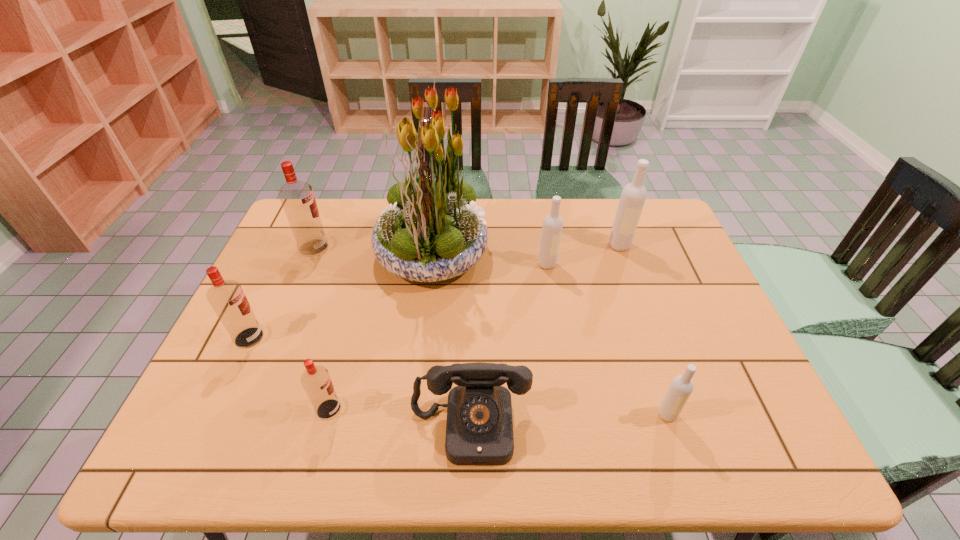
Where is `red vodka that is the second nearest to the farthest red vodka`? The image size is (960, 540). red vodka that is the second nearest to the farthest red vodka is located at coordinates (316, 381).

Locate which white vodka is the closest to the nearest white vodka. Please provide its 2D coordinates. Your answer should be formatted as a tuple, i.e. [(x, y)], where the tuple contains the x and y coordinates of a point satisfying the conditions above.

[(552, 227)]

Select which white vodka is the second closest to the biggest white vodka. Please provide its 2D coordinates. Your answer should be formatted as a tuple, i.e. [(x, y)], where the tuple contains the x and y coordinates of a point satisfying the conditions above.

[(681, 387)]

Locate an element on the screen. The image size is (960, 540). vacant position in the image that satisfies the following two spatial constraints: 1. on the front label of the smallest white vodka; 2. on the right side of the third vodka from left to right is located at coordinates (327, 414).

You are a GUI agent. You are given a task and a screenshot of the screen. Output one action in this format:
    pyautogui.click(x=<x>, y=<y>)
    Task: Click on the free space that satisfies the following two spatial constraints: 1. on the front side of the farthest white vodka; 2. on the front label of the farthest red vodka
    The height and width of the screenshot is (540, 960).
    Given the screenshot: What is the action you would take?
    pyautogui.click(x=620, y=248)

The width and height of the screenshot is (960, 540). I want to click on free space in the image that satisfies the following two spatial constraints: 1. on the front side of the farthest white vodka; 2. on the front label of the nearest red vodka, so click(x=678, y=409).

This screenshot has height=540, width=960. I want to click on free location that satisfies the following two spatial constraints: 1. on the back side of the nearest white vodka; 2. on the front label of the second farthest red vodka, so click(641, 338).

Image resolution: width=960 pixels, height=540 pixels. I want to click on vacant area that satisfies the following two spatial constraints: 1. on the front label of the smallest white vodka; 2. on the left side of the farthest red vodka, so click(245, 414).